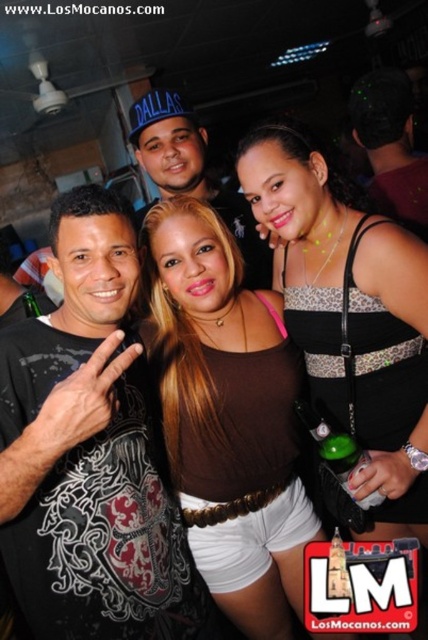
You are at a party and want to take a photo of the two items at the center of the scene. The items are the brown matte tank top at center and the matte blue cap at center. According to their positions, which one should you focus on first if you are moving from left to right across the scene?

The matte blue cap at center should be focused on first because the brown matte tank top at center is to the right of it, so moving from left to right, the matte blue cap at center comes first.

You are a photographer at the event and want to focus on the brown matte tank top at center and the matte blue cap at center. Which object should you adjust your camera focus on first if you want to capture both in sharp detail?

You should focus on the brown matte tank top at center first because it is closer to the viewer than the matte blue cap at center, allowing you to adjust focus accordingly for both objects.

You are at the center of the nightclub scene. You notice the leopard print tank top at center. Where exactly is it positioned in relation to the other elements in the scene?

The leopard print tank top at center is located at point (350, 316), which places it near the central area of the scene.